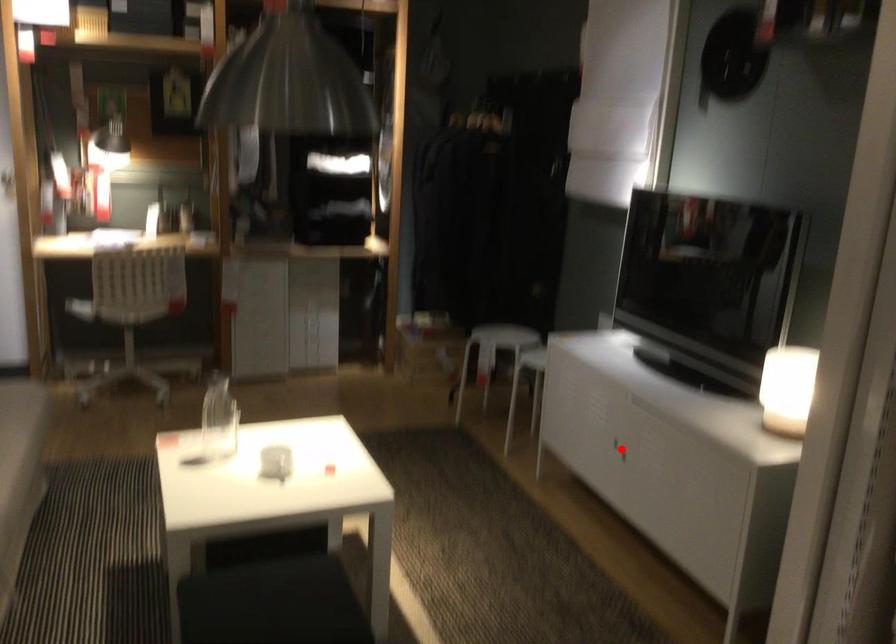
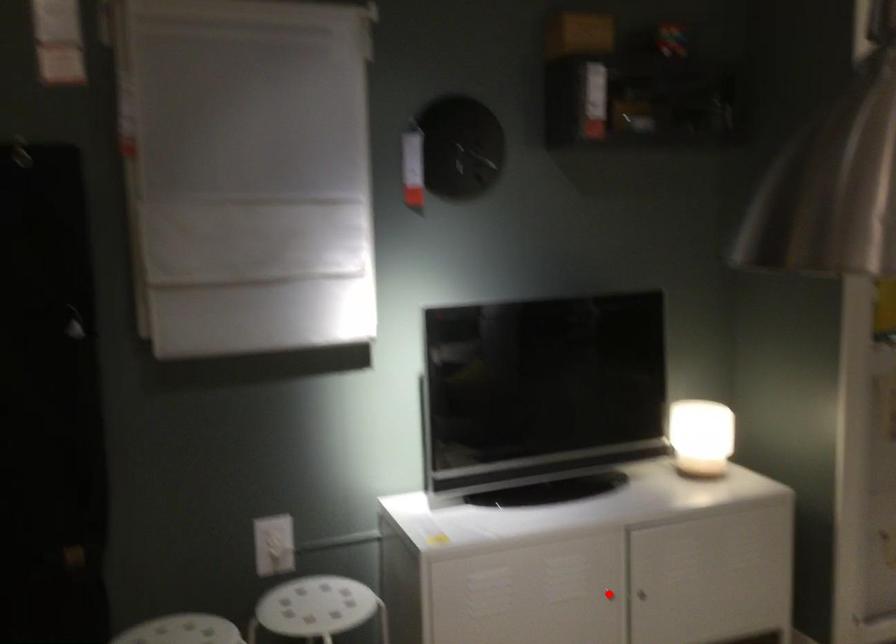
I am providing you with two images of the same scene from different viewpoints. A red point is marked on the first image and another point is marked on the second image. Is the red point in image1 aligned with the point shown in image2?

No